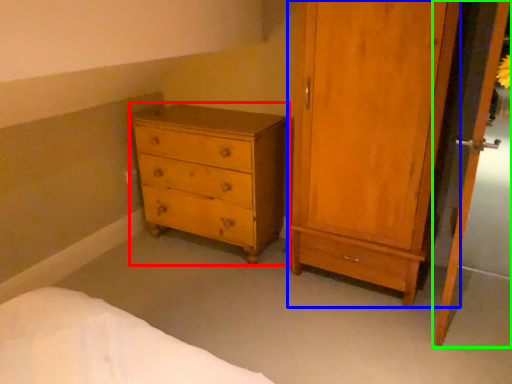
Question: Which object is the farthest from chest of drawers (highlighted by a red box)? Choose among these: door (highlighted by a blue box) or screen door (highlighted by a green box).

Choices:
 (A) door
 (B) screen door

Answer: (B)